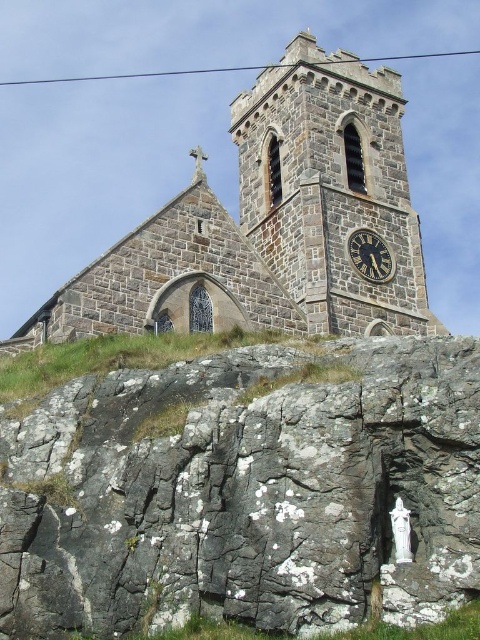
Question: Among these objects, which one is nearest to the camera?

Choices:
 (A) dark stone church at upper center
 (B) dark gray stone clock at center

Answer: (A)

Question: Which point is farther to the camera?

Choices:
 (A) dark stone church at upper center
 (B) stone clock tower at upper center
 (C) gray rough rock at lower center

Answer: (B)

Question: Among these points, which one is nearest to the camera?

Choices:
 (A) (393, 262)
 (B) (120, 392)
 (C) (336, 83)

Answer: (B)

Question: Is gray rough rock at lower center wider than stone clock tower at upper center?

Choices:
 (A) yes
 (B) no

Answer: (A)

Question: Where is dark stone church at upper center located in relation to stone clock tower at upper center in the image?

Choices:
 (A) above
 (B) below

Answer: (B)

Question: Does gray rough rock at lower center have a larger size compared to dark gray stone clock at center?

Choices:
 (A) yes
 (B) no

Answer: (A)